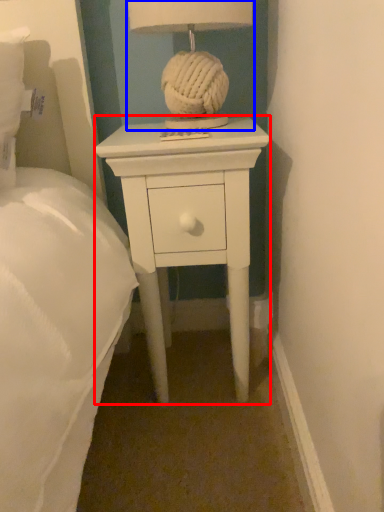
Question: Which point is closer to the camera, nightstand (highlighted by a red box) or table lamp (highlighted by a blue box)?

Choices:
 (A) nightstand
 (B) table lamp

Answer: (B)